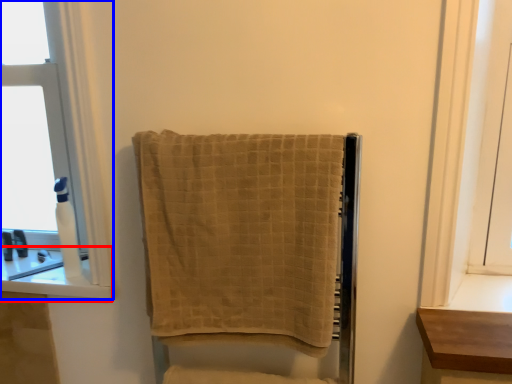
Question: Which of the following is the closest to the observer, window sill (highlighted by a red box) or window (highlighted by a blue box)?

Choices:
 (A) window sill
 (B) window

Answer: (A)